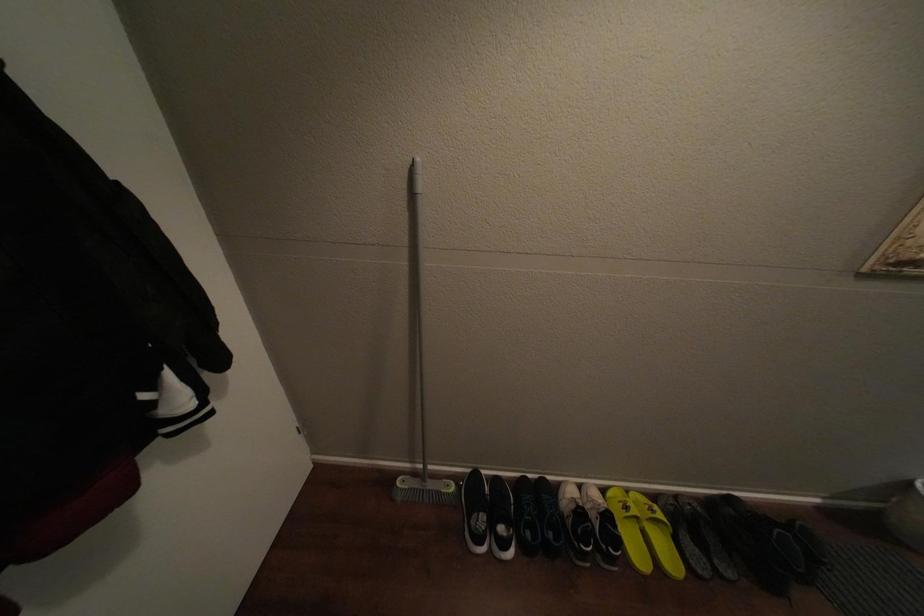
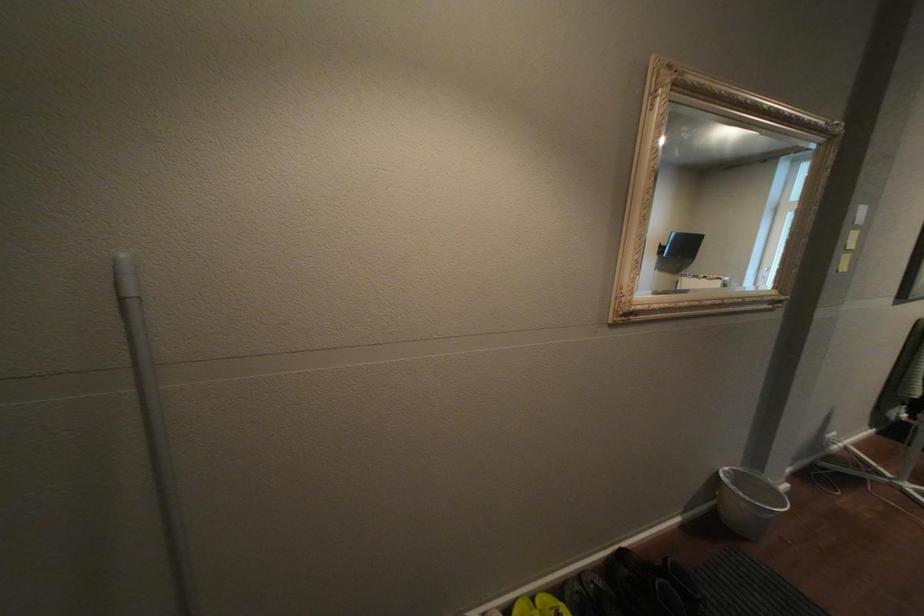
Question: Which direction would the cameraman need to move to produce the second image? Reply with the corresponding letter.

Choices:
 (A) Left
 (B) Right
 (C) Forward
 (D) Backward

Answer: (B)